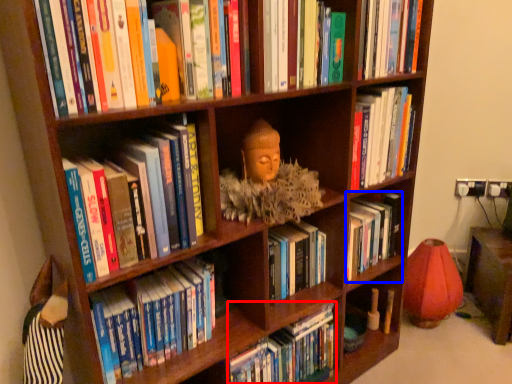
Question: Among these objects, which one is nearest to the camera, book (highlighted by a red box) or book (highlighted by a blue box)?

Choices:
 (A) book
 (B) book

Answer: (A)